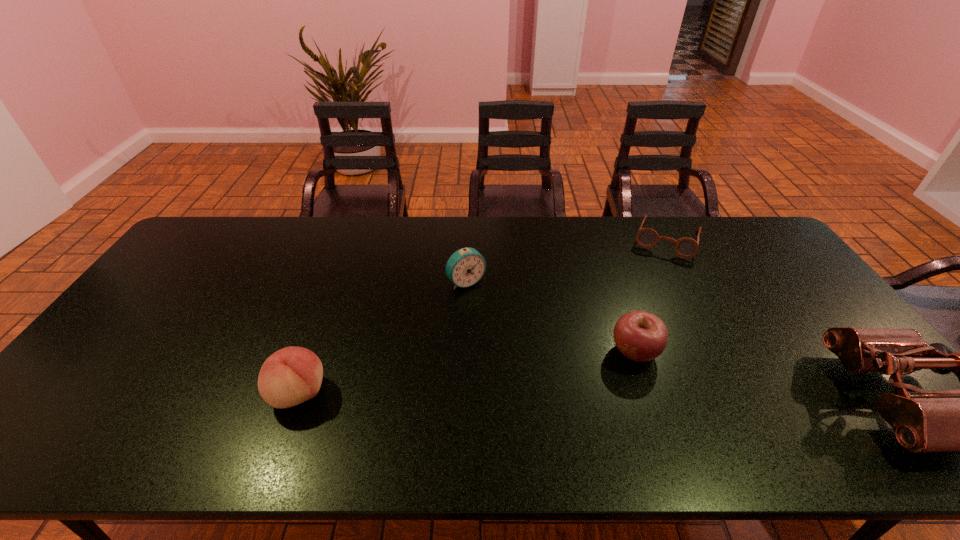
You are a GUI agent. You are given a task and a screenshot of the screen. Output one action in this format:
    pyautogui.click(x=<x>, y=<y>)
    Task: Click on the free location at the right edge of the desktop
    
    Given the screenshot: What is the action you would take?
    pyautogui.click(x=809, y=287)

Image resolution: width=960 pixels, height=540 pixels. What are the coordinates of `vacant space at the far right corner of the desktop` in the screenshot? It's located at (732, 235).

Locate an element on the screen. vacant region between the apple and the second farthest object is located at coordinates (550, 317).

Locate an element on the screen. empty space between the third object from left to right and the spectacles is located at coordinates (x=651, y=295).

The width and height of the screenshot is (960, 540). Identify the location of free area in between the peach and the alarm clock. (383, 338).

You are a GUI agent. You are given a task and a screenshot of the screen. Output one action in this format:
    pyautogui.click(x=<x>, y=<y>)
    Task: Click on the free area in between the farthest object and the fourth object from right to left
    
    Given the screenshot: What is the action you would take?
    tap(566, 260)

Identify the location of free space between the apple and the alarm clock. This screenshot has width=960, height=540. 550,317.

At what (x,y) coordinates should I click in order to perform the action: click on the fourth closest object to the farthest object. Please return your answer as a coordinate pair (x, y). The width and height of the screenshot is (960, 540). Looking at the image, I should click on (290, 376).

Point out which object is positioned as the fourth nearest to the farthest object. Please provide its 2D coordinates. Your answer should be formatted as a tuple, i.e. [(x, y)], where the tuple contains the x and y coordinates of a point satisfying the conditions above.

[(290, 376)]

Where is `free space that satisfies the following two spatial constraints: 1. on the back side of the leftmost object; 2. on the right side of the apple`? This screenshot has width=960, height=540. free space that satisfies the following two spatial constraints: 1. on the back side of the leftmost object; 2. on the right side of the apple is located at coordinates (314, 352).